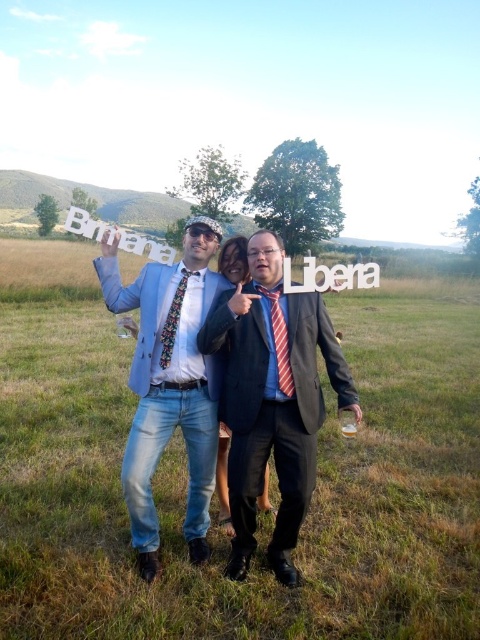
Question: Which of the following is the farthest from the observer?

Choices:
 (A) matte blue dress at center
 (B) matte black suit at center
 (C) light blue denim jeans at center

Answer: (A)

Question: Which point appears closest to the camera in this image?

Choices:
 (A) (304, 369)
 (B) (153, 499)

Answer: (A)

Question: Is light blue denim jeans at center above matte blue dress at center?

Choices:
 (A) no
 (B) yes

Answer: (B)

Question: Based on their relative distances, which object is nearer to the light blue denim jeans at center?

Choices:
 (A) matte black suit at center
 (B) matte blue dress at center

Answer: (A)

Question: Does matte black suit at center have a lesser width compared to matte blue dress at center?

Choices:
 (A) yes
 (B) no

Answer: (B)

Question: Is light blue denim jeans at center below matte blue dress at center?

Choices:
 (A) no
 (B) yes

Answer: (A)